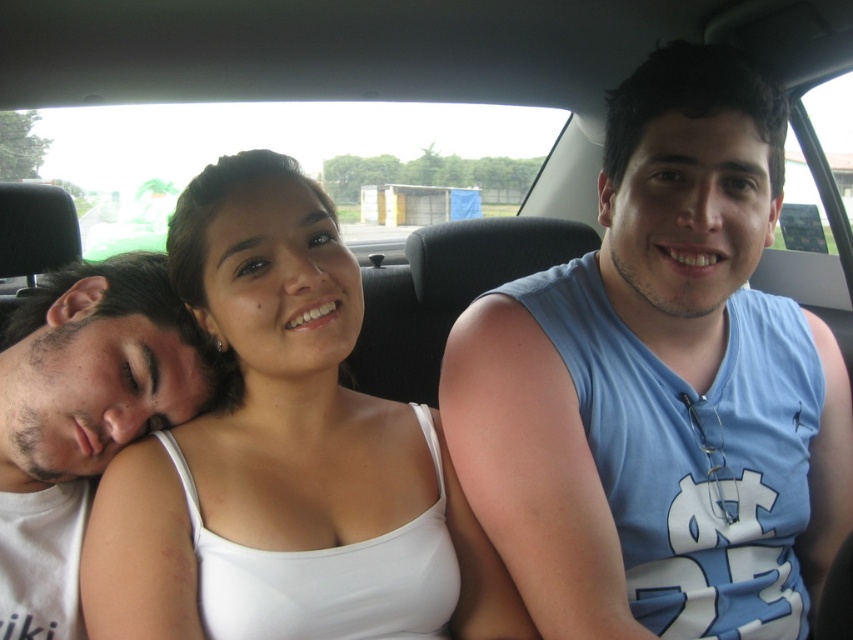
You are a photographer standing 3 feet away from the car. You want to take a clear photo of the white matte tank top at center. Can you adjust your position to ensure the subject is in focus?

The white matte tank top at center is 33.48 inches away from the camera. Since you are currently 3 feet away, which is 36 inches, you need to move closer by approximately 2.52 inches to ensure the subject is in focus.

You are a photographer taking a picture of the blue sleeveless shirt at upper right and the white cotton shirt at left. Which shirt appears taller in the photo?

The blue sleeveless shirt at upper right appears taller than the white cotton shirt at left in the photo.

Consider the image. You are sitting in the backseat of the car and want to hand a snack to the person wearing the blue sleeveless shirt at upper right and the white cotton shirt at left. Which person is easier to reach?

The blue sleeveless shirt at upper right is closer to the viewer than the white cotton shirt at left, so it is easier to reach the person wearing the blue sleeveless shirt at upper right.